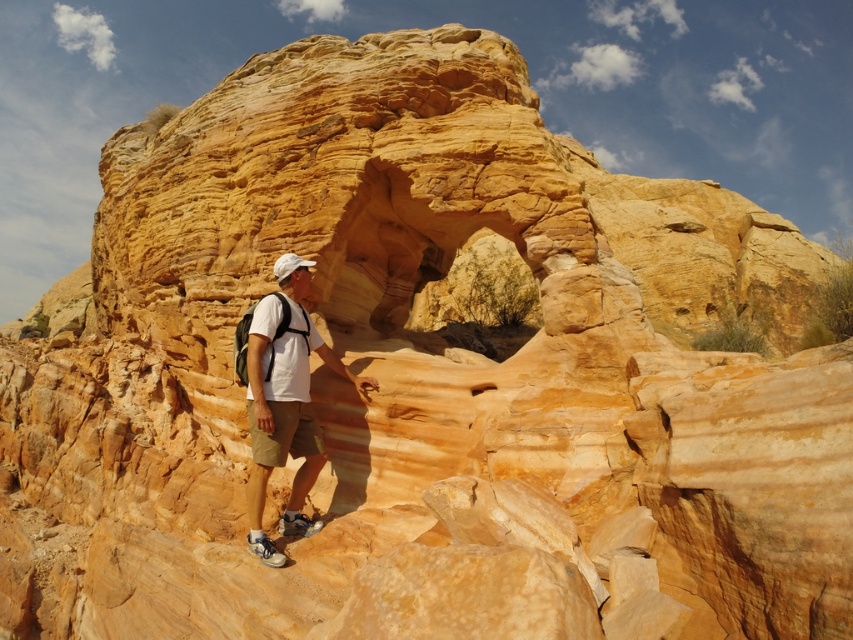
Question: Can you confirm if white matte shirt at center is positioned to the left of white matte baseball hat at center?

Choices:
 (A) yes
 (B) no

Answer: (B)

Question: Which point appears closest to the camera in this image?

Choices:
 (A) (279, 257)
 (B) (354, 380)

Answer: (B)

Question: Among these points, which one is farthest from the camera?

Choices:
 (A) (276, 272)
 (B) (267, 400)

Answer: (A)

Question: In this image, where is white matte shirt at center located relative to white matte baseball hat at center?

Choices:
 (A) below
 (B) above

Answer: (A)

Question: Can you confirm if white matte shirt at center is wider than white matte baseball hat at center?

Choices:
 (A) no
 (B) yes

Answer: (B)